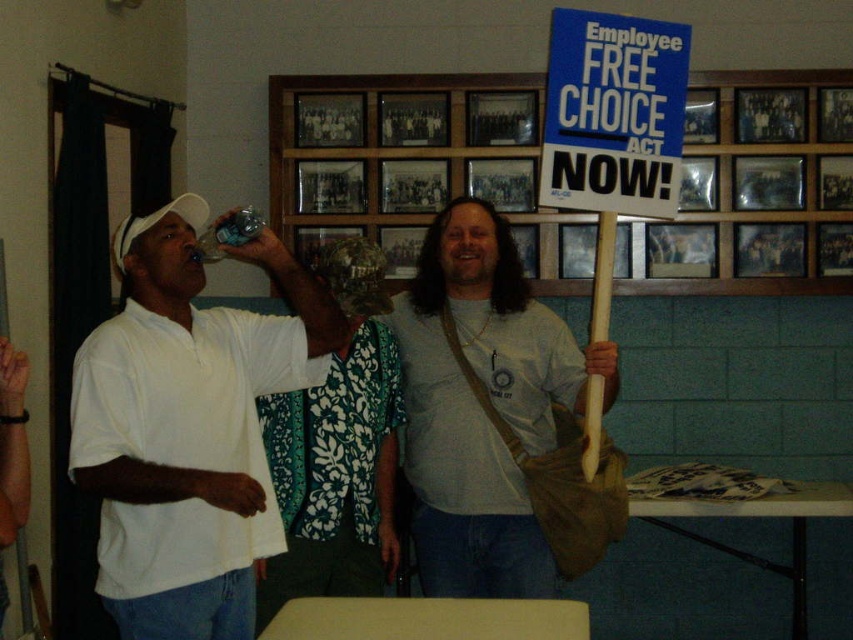
Question: Can you confirm if light gray cotton shirt at center is wider than blue cardboard sign at upper center?

Choices:
 (A) no
 (B) yes

Answer: (A)

Question: Is floral fabric shirt at center to the left of blue cardboard sign at upper center from the viewer's perspective?

Choices:
 (A) yes
 (B) no

Answer: (A)

Question: Which object appears farthest from the camera in this image?

Choices:
 (A) white matte shirt at left
 (B) light gray cotton shirt at center
 (C) blue paper sign at upper right
 (D) floral fabric shirt at center

Answer: (D)

Question: Which object appears farthest from the camera in this image?

Choices:
 (A) blue cardboard sign at upper center
 (B) white matte shirt at left

Answer: (A)

Question: Among these points, which one is farthest from the camera?

Choices:
 (A) (722, 221)
 (B) (549, 180)

Answer: (A)

Question: Can you confirm if white matte shirt at left is bigger than blue cardboard sign at upper center?

Choices:
 (A) yes
 (B) no

Answer: (A)